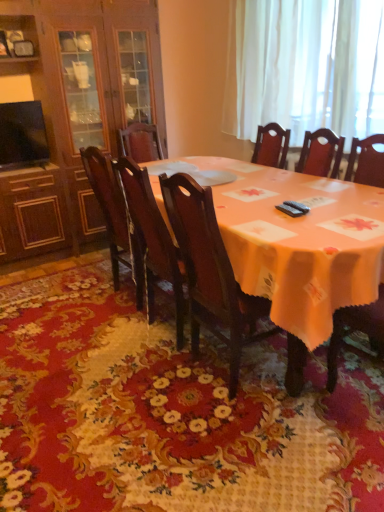
At what (x,y) coordinates should I click in order to perform the action: click on vacant space positioned to the left of dark wood chair at center, which is counted as the first chair, starting from the right. Please return your answer as a coordinate pair (x, y). Image resolution: width=384 pixels, height=512 pixels. Looking at the image, I should click on (146, 388).